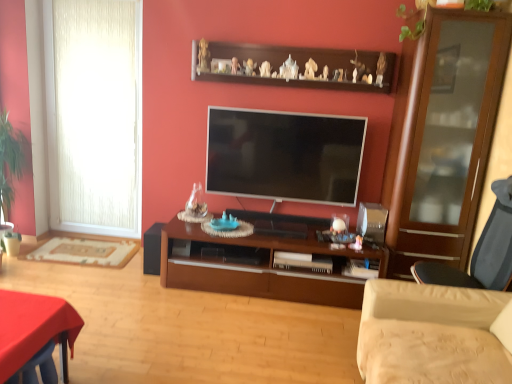
Where is `free space above smooth red table at lower left (from a real-world perspective)`? Image resolution: width=512 pixels, height=384 pixels. free space above smooth red table at lower left (from a real-world perspective) is located at coordinates (22, 313).